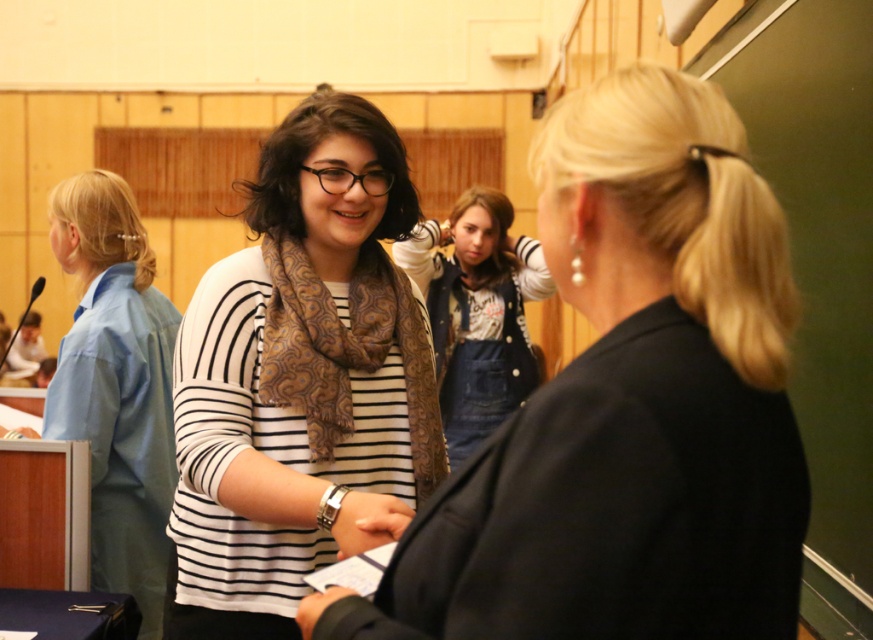
You are organizing a charity event and need to decide which item to place in a donation box. The blue fabric shirt at left and the brown paisley scarf at center are both available. Based on their sizes, which item would take up more space in the box?

The blue fabric shirt at left is larger in size than the brown paisley scarf at center, so it would take up more space in the donation box.

You are organizing a photo shoot and need to ensure that the striped cotton shirt at center and the brown paisley scarf at center are both visible in the final image. Based on their current positions, will both items be fully visible in the photo?

The striped cotton shirt at center is in front of the brown paisley scarf at center, so the scarf may be partially obscured by the shirt, making it not fully visible. The shirt will be fully visible, but the scarf might not be.

You are organizing a clothing donation drive and need to sort items by size. You have two shirts in front of you, the striped cotton shirt at center and the blue fabric shirt at left. Based on their sizes, which one should you place in the small section?

The striped cotton shirt at center has a smaller size compared to the blue fabric shirt at left, so it should be placed in the small section.